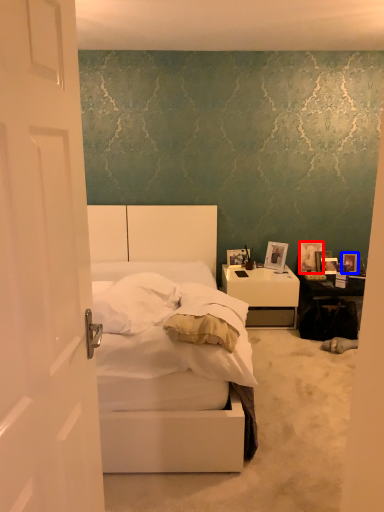
Question: Which of the following is the closest to the observer, picture frame (highlighted by a red box) or picture frame (highlighted by a blue box)?

Choices:
 (A) picture frame
 (B) picture frame

Answer: (B)